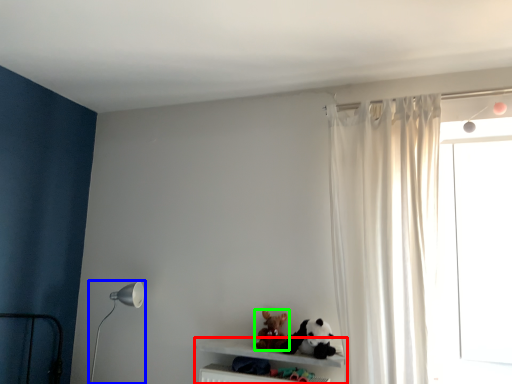
Question: Considering the real-world distances, which object is closest to shelf (highlighted by a red box)? table lamp (highlighted by a blue box) or toy (highlighted by a green box).

Choices:
 (A) table lamp
 (B) toy

Answer: (B)